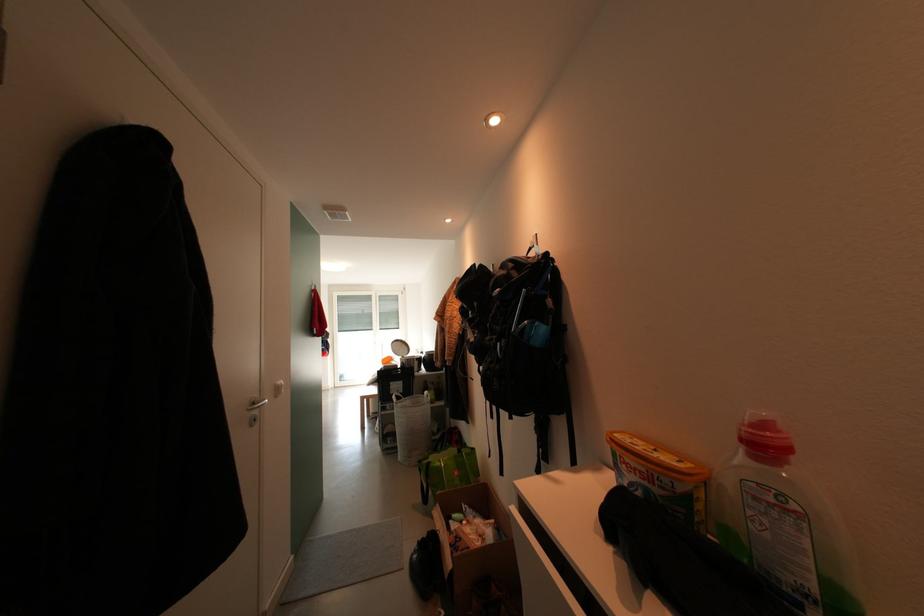
What do you see at coordinates (256, 403) in the screenshot? Image resolution: width=924 pixels, height=616 pixels. I see `the silver door handle` at bounding box center [256, 403].